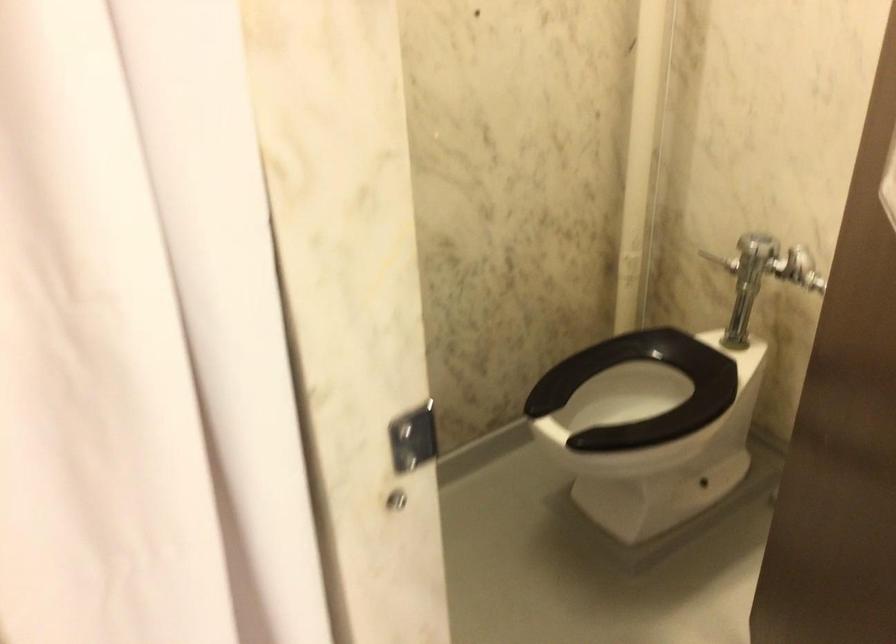
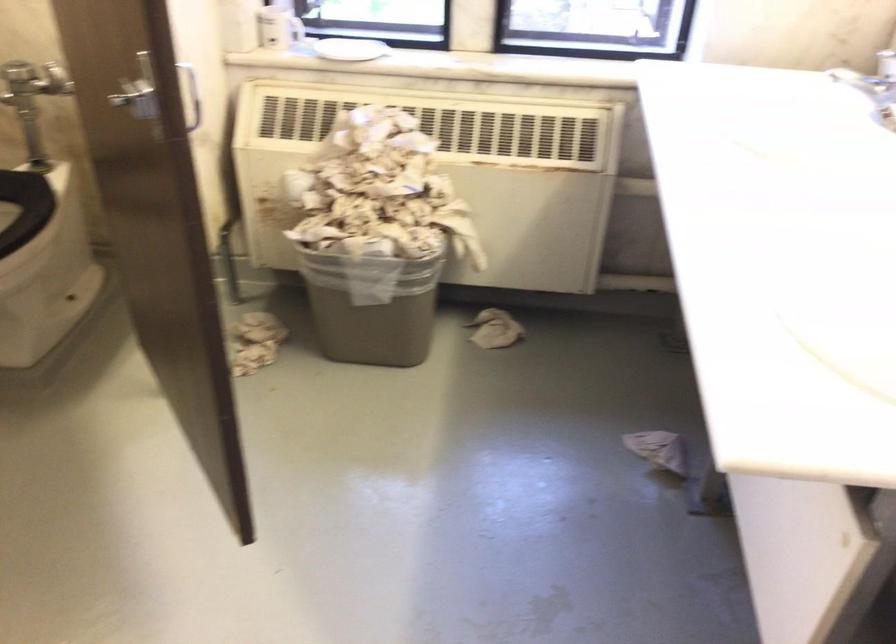
Locate, in the second image, the point that corresponds to [771,263] in the first image.

(32, 80)